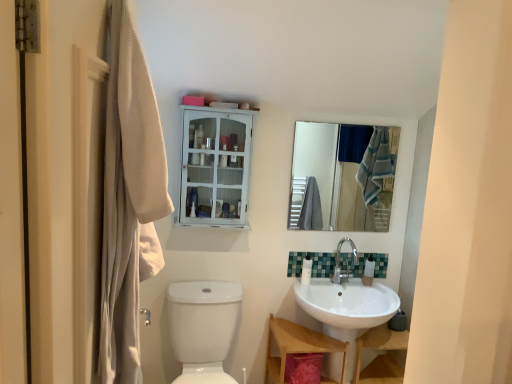
This screenshot has width=512, height=384. What do you see at coordinates (346, 262) in the screenshot? I see `silver metallic faucet at center` at bounding box center [346, 262].

This screenshot has width=512, height=384. In order to click on clear glass mirror at upper center in this screenshot , I will do `click(344, 175)`.

Locate an element on the screen. beige textured robe at left is located at coordinates [x=129, y=198].

Locate an element on the screen. The image size is (512, 384). white glossy toilet bowl at lower left is located at coordinates (203, 327).

What do you see at coordinates (306, 270) in the screenshot?
I see `white glossy bottle at lower center, marked as the first toiletry in a left-to-right arrangement` at bounding box center [306, 270].

In order to face white glossy bottle at lower center, the second toiletry when ordered from right to left, should I rotate leftwards or rightwards?

Rotate right and turn 6.590 degrees.

Find the location of a particular element. This screenshot has width=512, height=384. silver metallic faucet at center is located at coordinates (346, 262).

How many degrees apart are the facing directions of beige textured robe at left and clear glass mirror at upper center?

There is a 89.3-degree angle between the facing directions of beige textured robe at left and clear glass mirror at upper center.

At what (x,y) coordinates should I click in order to perform the action: click on mirror above the beige textured robe at left (from the image's perspective). Please return your answer as a coordinate pair (x, y). Looking at the image, I should click on (344, 175).

Does point (155, 183) lie in front of point (380, 142)?

Yes, point (155, 183) is closer to viewer.

Is white glossy bottle at right, which ranks as the 2th toiletry in left-to-right order, to the left of wooden vanity at lower center from the viewer's perspective?

No, white glossy bottle at right, which ranks as the 2th toiletry in left-to-right order, is not to the left of wooden vanity at lower center.

In the image, is white glossy bottle at right, which ranks as the 2th toiletry in left-to-right order, positioned in front of or behind wooden vanity at lower center?

In the image, white glossy bottle at right, which ranks as the 2th toiletry in left-to-right order, appears behind wooden vanity at lower center.

Can you confirm if white glossy bottle at right, marked as the 1th toiletry in a right-to-left arrangement, is smaller than wooden vanity at lower center?

Indeed, white glossy bottle at right, marked as the 1th toiletry in a right-to-left arrangement, has a smaller size compared to wooden vanity at lower center.

You are a GUI agent. You are given a task and a screenshot of the screen. Output one action in this format:
    pyautogui.click(x=<x>, y=<y>)
    Task: Click on the 1st toiletry above when counting from the wooden vanity at lower center (from the image's perspective)
    
    Given the screenshot: What is the action you would take?
    pyautogui.click(x=368, y=271)

Is silver metallic faucet at center far from white glossy bottle at right, marked as the 1th toiletry in a right-to-left arrangement?

They are positioned close to each other.

In the image, is silver metallic faucet at center on the left side or the right side of white glossy bottle at right, which ranks as the 2th toiletry in left-to-right order?

From the image, it's evident that silver metallic faucet at center is to the left of white glossy bottle at right, which ranks as the 2th toiletry in left-to-right order.

Would you say white glossy bottle at right, marked as the 1th toiletry in a right-to-left arrangement, is part of silver metallic faucet at center's contents?

No, white glossy bottle at right, marked as the 1th toiletry in a right-to-left arrangement, is located outside of silver metallic faucet at center.

Is silver metallic faucet at center facing away from white glossy bottle at right, marked as the 1th toiletry in a right-to-left arrangement?

No, silver metallic faucet at center is not facing away from white glossy bottle at right, marked as the 1th toiletry in a right-to-left arrangement.

Is white glossy bottle at right, marked as the 1th toiletry in a right-to-left arrangement, turned away from clear glass mirror at upper center?

No, white glossy bottle at right, marked as the 1th toiletry in a right-to-left arrangement, is not facing away from clear glass mirror at upper center.

From a real-world perspective, is white glossy bottle at right, which ranks as the 2th toiletry in left-to-right order, below clear glass mirror at upper center?

Yes.

Considering the positions of objects white glossy bottle at right, marked as the 1th toiletry in a right-to-left arrangement, and clear glass mirror at upper center in the image provided, who is in front, white glossy bottle at right, marked as the 1th toiletry in a right-to-left arrangement, or clear glass mirror at upper center?

clear glass mirror at upper center is in front.

Does white glossy bottle at right, which ranks as the 2th toiletry in left-to-right order, have a greater width compared to clear glass mirror at upper center?

Correct, the width of white glossy bottle at right, which ranks as the 2th toiletry in left-to-right order, exceeds that of clear glass mirror at upper center.

Who is smaller, silver metallic faucet at center or white glossy sink at lower right?

silver metallic faucet at center.

Between silver metallic faucet at center and white glossy sink at lower right, which one appears on the left side from the viewer's perspective?

white glossy sink at lower right is more to the left.

Is silver metallic faucet at center taller or shorter than white glossy sink at lower right?

Clearly, silver metallic faucet at center is shorter compared to white glossy sink at lower right.

In the scene shown: From a real-world perspective, is silver metallic faucet at center physically located above or below white glossy sink at lower right?

silver metallic faucet at center is above white glossy sink at lower right.

From a real-world perspective, is white glossy sink at lower right physically located above or below white wooden cabinet at upper center?

white glossy sink at lower right is situated lower than white wooden cabinet at upper center in the real world.

Is white glossy sink at lower right to the right of white wooden cabinet at upper center from the viewer's perspective?

Correct, you'll find white glossy sink at lower right to the right of white wooden cabinet at upper center.

Do you think white glossy sink at lower right is within white wooden cabinet at upper center, or outside of it?

white glossy sink at lower right cannot be found inside white wooden cabinet at upper center.

Looking at this image, from the image's perspective, is white glossy sink at lower right on top of beige textured robe at left?

No, from the image's perspective, white glossy sink at lower right is not above beige textured robe at left.

In the scene shown: Considering the sizes of objects white glossy sink at lower right and beige textured robe at left in the image provided, who is wider, white glossy sink at lower right or beige textured robe at left?

Wider between the two is white glossy sink at lower right.

At what (x,y) coordinates should I click in order to perform the action: click on sink to the right of beige textured robe at left. Please return your answer as a coordinate pair (x, y). Looking at the image, I should click on (347, 309).

You are a GUI agent. You are given a task and a screenshot of the screen. Output one action in this format:
    pyautogui.click(x=<x>, y=<y>)
    Task: Click on the mirror lying behind the beige textured robe at left
    This screenshot has height=384, width=512.
    Given the screenshot: What is the action you would take?
    pyautogui.click(x=344, y=175)

Find the location of a particular element. vanity lying in front of the white glossy bottle at right, marked as the 1th toiletry in a right-to-left arrangement is located at coordinates (298, 347).

From the image, which object appears to be farther from white glossy toilet bowl at lower left, silver metallic faucet at center or green mosaic tile at center?

Among the two, silver metallic faucet at center is located further to white glossy toilet bowl at lower left.

In the scene shown: Based on their spatial positions, is wooden vanity at lower center or green mosaic tile at center closer to white glossy bottle at lower center, marked as the first toiletry in a left-to-right arrangement?

The object closer to white glossy bottle at lower center, marked as the first toiletry in a left-to-right arrangement, is green mosaic tile at center.

Based on their spatial positions, is white glossy bottle at right, marked as the 1th toiletry in a right-to-left arrangement, or white glossy toilet bowl at lower left closer to green mosaic tile at center?

Among the two, white glossy bottle at right, marked as the 1th toiletry in a right-to-left arrangement, is located nearer to green mosaic tile at center.

Looking at the image, which one is located further to white wooden cabinet at upper center, white glossy toilet bowl at lower left or silver metallic faucet at center?

silver metallic faucet at center is positioned further to the anchor white wooden cabinet at upper center.

Estimate the real-world distances between objects in this image. Which object is closer to white glossy bottle at right, which ranks as the 2th toiletry in left-to-right order, white wooden cabinet at upper center or white glossy sink at lower right?

Based on the image, white glossy sink at lower right appears to be nearer to white glossy bottle at right, which ranks as the 2th toiletry in left-to-right order.

From the image, which object appears to be farther from white glossy bottle at lower center, marked as the first toiletry in a left-to-right arrangement, white glossy bottle at right, which ranks as the 2th toiletry in left-to-right order, or beige textured robe at left?

beige textured robe at left lies further to white glossy bottle at lower center, marked as the first toiletry in a left-to-right arrangement, than the other object.

Considering their positions, is white glossy toilet bowl at lower left positioned further to white glossy bottle at right, marked as the 1th toiletry in a right-to-left arrangement, than white wooden cabinet at upper center?

Among the two, white wooden cabinet at upper center is located further to white glossy bottle at right, marked as the 1th toiletry in a right-to-left arrangement.

Estimate the real-world distances between objects in this image. Which object is closer to white glossy bottle at right, which ranks as the 2th toiletry in left-to-right order, beige textured robe at left or green mosaic tile at center?

Based on the image, green mosaic tile at center appears to be nearer to white glossy bottle at right, which ranks as the 2th toiletry in left-to-right order.

You are a GUI agent. You are given a task and a screenshot of the screen. Output one action in this format:
    pyautogui.click(x=<x>, y=<y>)
    Task: Click on the toiletry that lies between white glossy bottle at lower center, marked as the first toiletry in a left-to-right arrangement, and white glossy sink at lower right from top to bottom
    The width and height of the screenshot is (512, 384).
    Given the screenshot: What is the action you would take?
    (368, 271)

Where is `toiletry between white glossy toilet bowl at lower left and white glossy bottle at right, which ranks as the 2th toiletry in left-to-right order, from left to right`? This screenshot has width=512, height=384. toiletry between white glossy toilet bowl at lower left and white glossy bottle at right, which ranks as the 2th toiletry in left-to-right order, from left to right is located at coordinates (306, 270).

At what (x,y) coordinates should I click in order to perform the action: click on tap between white wooden cabinet at upper center and wooden vanity at lower center from top to bottom. Please return your answer as a coordinate pair (x, y). Looking at the image, I should click on (346, 262).

Where is `sink between silver metallic faucet at center and wooden vanity at lower center vertically`? The image size is (512, 384). sink between silver metallic faucet at center and wooden vanity at lower center vertically is located at coordinates point(347,309).